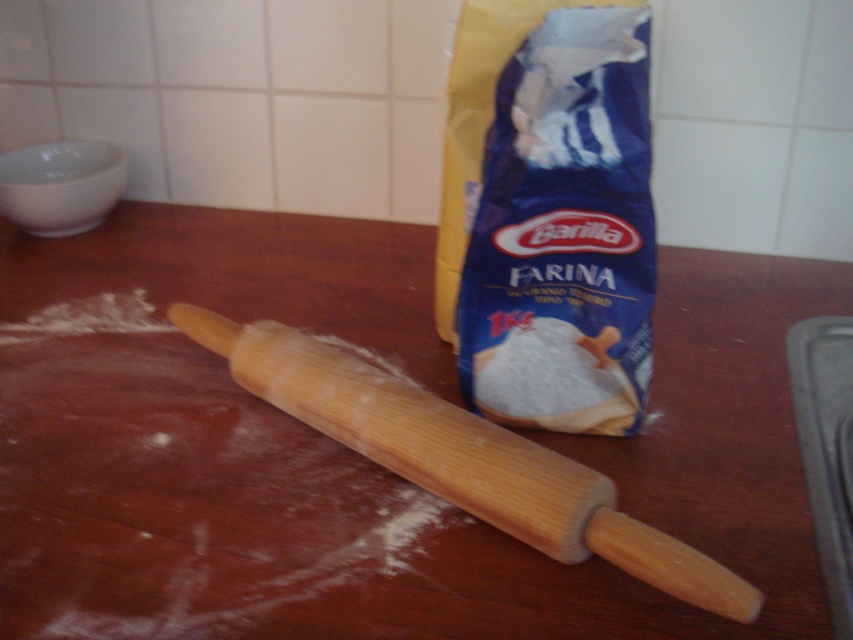
You are a baker who just finished rolling out dough and notice a white powder at rolling pin left. Where exactly is this white powder located relative to the rolling pin?

The white powder at rolling pin left is located at point (194,499) relative to the rolling pin.

You are a chef preparing dough and see the white powder at rolling pin left and the wooden rolling pin at center on the countertop. Which object is wider?

The white powder at rolling pin left is wider than the wooden rolling pin at center.

You are a baker who needs to check the height of the white powder at rolling pin left and the blue paper bag at upper right. Which one is taller?

The blue paper bag at upper right is taller than the white powder at rolling pin left.